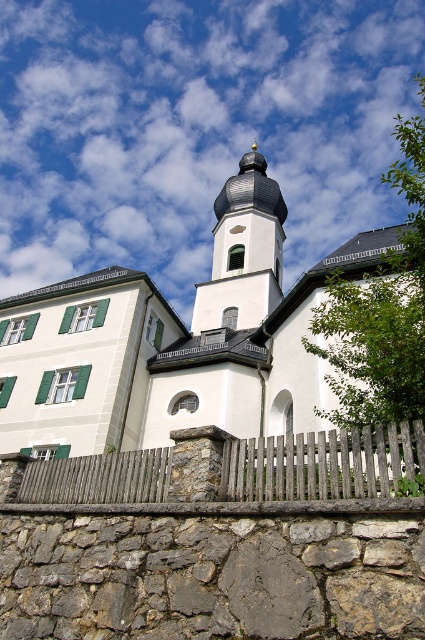
Question: Which point is farther from the camera taking this photo?

Choices:
 (A) (218, 212)
 (B) (241, 189)

Answer: (A)

Question: From the image, what is the correct spatial relationship of white stone church at upper center in relation to wooden picket fence at lower center?

Choices:
 (A) below
 (B) above

Answer: (B)

Question: Does wooden picket fence at lower center lie in front of white stone tower at center?

Choices:
 (A) yes
 (B) no

Answer: (A)

Question: Which of the following is the farthest from the observer?

Choices:
 (A) (204, 296)
 (B) (107, 275)
 (C) (156, 464)

Answer: (A)

Question: Can you confirm if white stone church at upper center is bigger than wooden picket fence at lower center?

Choices:
 (A) yes
 (B) no

Answer: (A)

Question: Which object is the closest to the white stone church at upper center?

Choices:
 (A) wooden picket fence at lower center
 (B) white stone tower at center

Answer: (B)